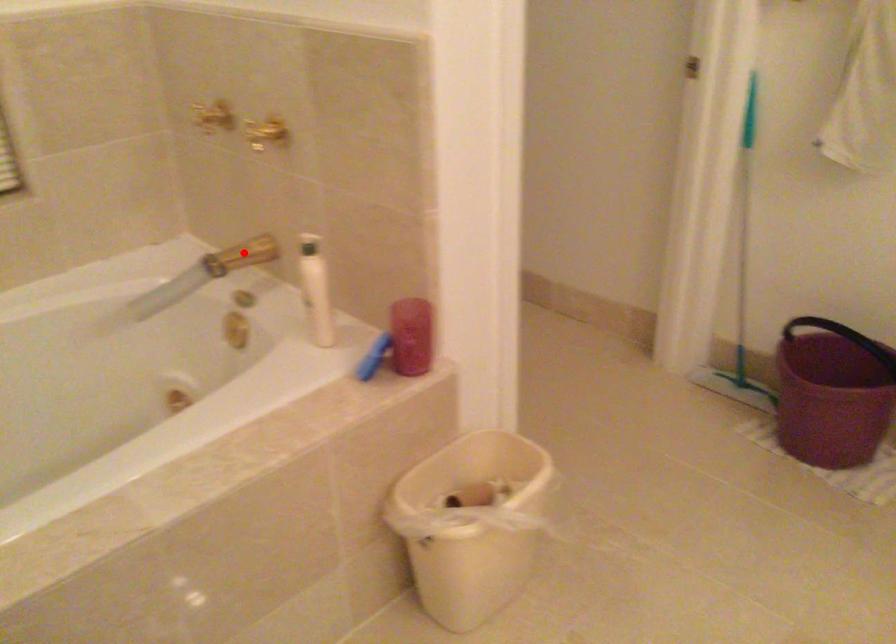
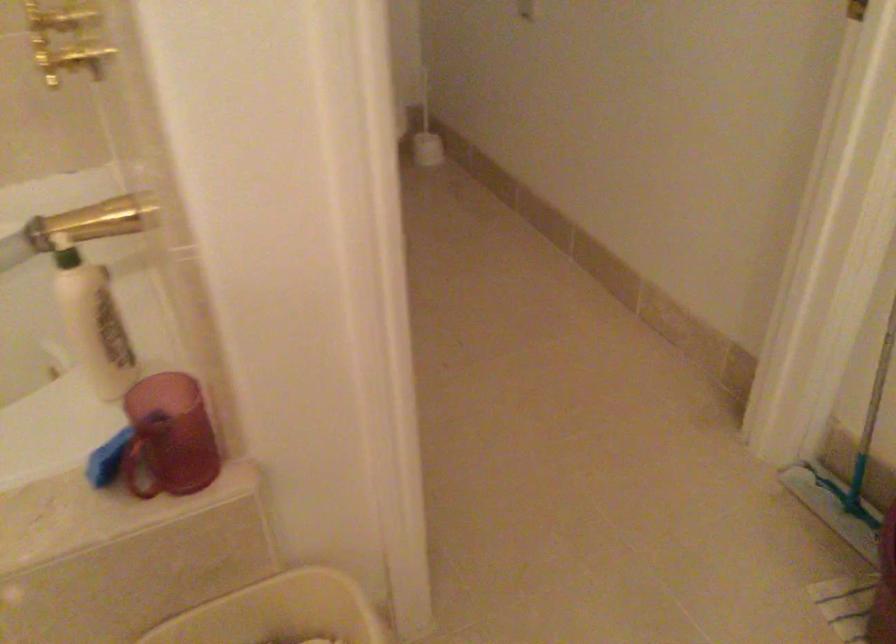
Question: I am providing you with two images of the same scene from different viewpoints. In image1, a red point is highlighted. Considering the same 3D point in image2, which of the following is correct?

Choices:
 (A) It is closer
 (B) It is farther

Answer: (A)